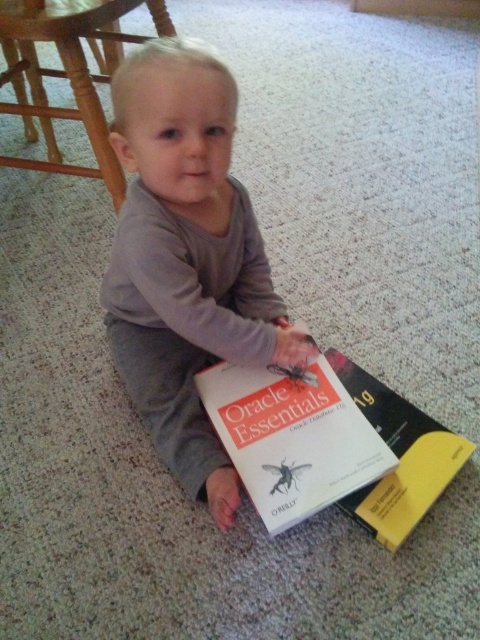
You are a robot trying to locate the hardcover book at center. According to the coordinates provided, where should you move to find it?

The hardcover book at center is located at coordinates point [398,456].

You are a parent trying to organize your child study area. You have a small shelf that can only hold items up to 10cm in height. You see the hardcover book at center and the translucent plastic insect at center. Which item should you place on the shelf to ensure it fits?

The translucent plastic insect at center should be placed on the shelf since it is smaller than the hardcover book at center and likely under the 10cm height limit.